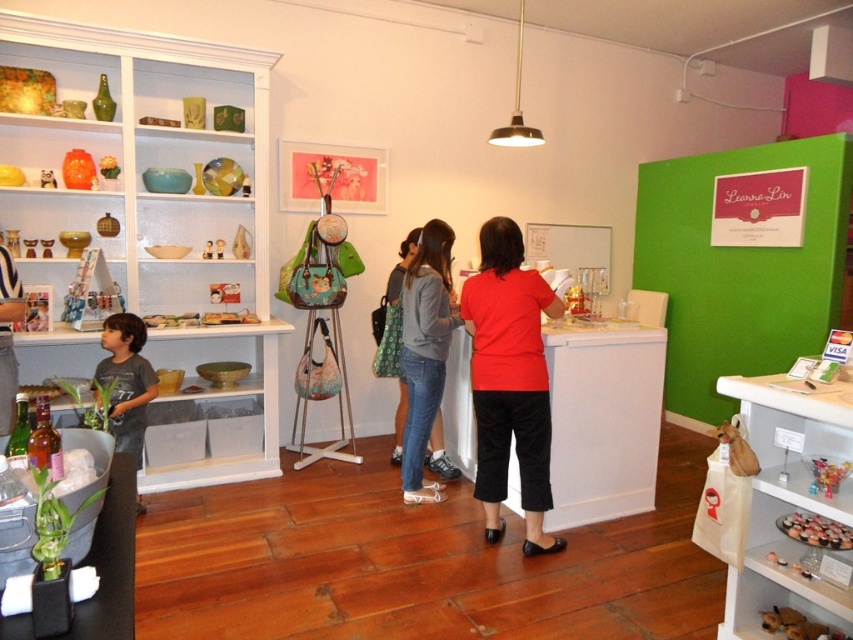
Who is positioned more to the left, matte red blouse at center or gray cotton shirt at left?

gray cotton shirt at left is more to the left.

Which of these two, matte red blouse at center or gray cotton shirt at left, stands taller?

Standing taller between the two is matte red blouse at center.

What do you see at coordinates (509, 380) in the screenshot? The height and width of the screenshot is (640, 853). I see `matte red blouse at center` at bounding box center [509, 380].

You are a GUI agent. You are given a task and a screenshot of the screen. Output one action in this format:
    pyautogui.click(x=<x>, y=<y>)
    Task: Click on the matte red blouse at center
    
    Given the screenshot: What is the action you would take?
    pyautogui.click(x=509, y=380)

Does matte red blouse at center have a greater height compared to denim jacket at center?

Correct, matte red blouse at center is much taller as denim jacket at center.

Is matte red blouse at center behind denim jacket at center?

That is False.

Between point (531, 417) and point (393, 300), which one is positioned behind?

The point (393, 300) is more distant.

This screenshot has width=853, height=640. Identify the location of matte red blouse at center. click(x=509, y=380).

Who is taller, matte black shirt at left or denim jacket at center?

Standing taller between the two is matte black shirt at left.

Is matte black shirt at left closer to the viewer compared to denim jacket at center?

Yes, it is in front of denim jacket at center.

Does point (9, 349) lie in front of point (431, 445)?

Yes, point (9, 349) is closer to viewer.

You are a GUI agent. You are given a task and a screenshot of the screen. Output one action in this format:
    pyautogui.click(x=<x>, y=<y>)
    Task: Click on the matte black shirt at left
    
    Given the screenshot: What is the action you would take?
    pyautogui.click(x=9, y=336)